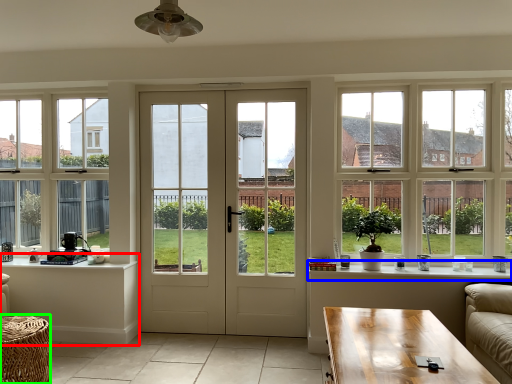
Question: Which object is the farthest from table (highlighted by a red box)? Choose among these: window sill (highlighted by a blue box) or table (highlighted by a green box).

Choices:
 (A) window sill
 (B) table

Answer: (A)